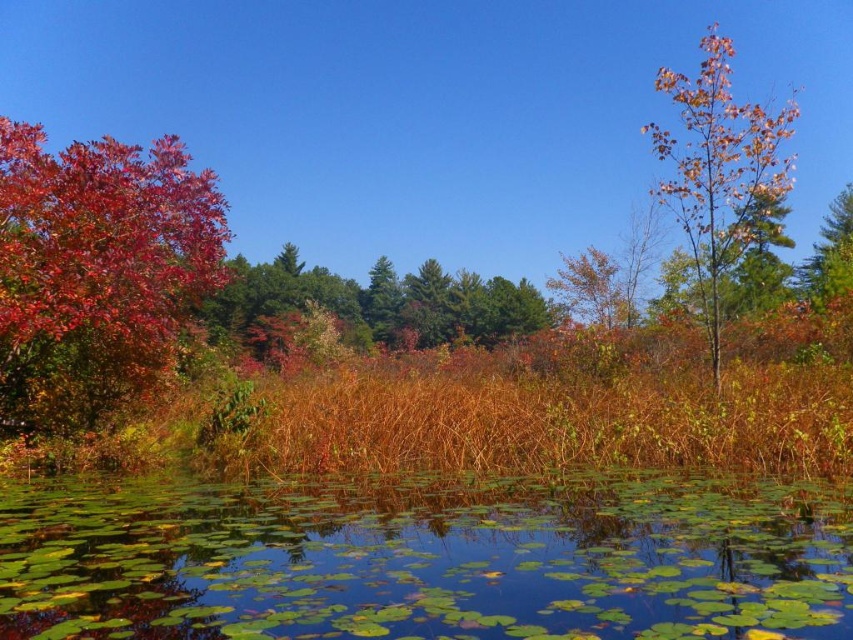
Is green leafy water at bottom bigger than autumn leaves at center?

Actually, green leafy water at bottom might be smaller than autumn leaves at center.

Is green leafy water at bottom above autumn leaves at center?

No, green leafy water at bottom is not above autumn leaves at center.

Which is behind, point (543, 608) or point (337, 314)?

The point (337, 314) is behind.

This screenshot has width=853, height=640. I want to click on green leafy water at bottom, so click(425, 561).

Does shiny red leaves at left appear on the right side of orange-brown bark tree at upper right?

Incorrect, shiny red leaves at left is not on the right side of orange-brown bark tree at upper right.

Between shiny red leaves at left and orange-brown bark tree at upper right, which one has more height?

orange-brown bark tree at upper right is taller.

This screenshot has height=640, width=853. Find the location of `shiny red leaves at left`. shiny red leaves at left is located at coordinates (96, 273).

Identify the location of shiny red leaves at left. This screenshot has width=853, height=640. (96, 273).

Can you confirm if autumn leaves at center is smaller than green matte tree at upper right?

No.

The image size is (853, 640). I want to click on autumn leaves at center, so click(373, 305).